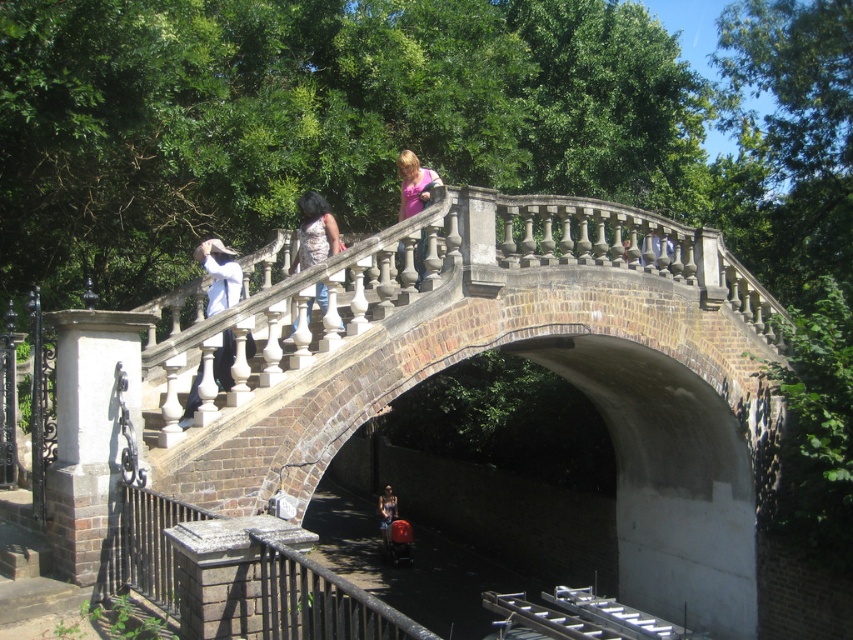
Question: Does brown stone bridge at upper center lie in front of matte white pants at upper center?

Choices:
 (A) no
 (B) yes

Answer: (B)

Question: Can you confirm if dark blue jeans at center is bigger than matte white pants at upper center?

Choices:
 (A) yes
 (B) no

Answer: (B)

Question: Which point is farther to the camera?

Choices:
 (A) (421, 198)
 (B) (654, 250)
 (C) (314, 216)
 (D) (552, 369)

Answer: (D)

Question: Which point is farther from the camera taking this photo?

Choices:
 (A) (x=654, y=257)
 (B) (x=318, y=227)
 (C) (x=224, y=305)
 (D) (x=358, y=308)

Answer: (A)

Question: Can you confirm if brown stone bridge at upper center is bigger than patterned fabric shirt at center?

Choices:
 (A) yes
 (B) no

Answer: (A)

Question: Which point is farther to the camera?

Choices:
 (A) (409, 193)
 (B) (383, 525)
 (C) (599, 320)

Answer: (B)